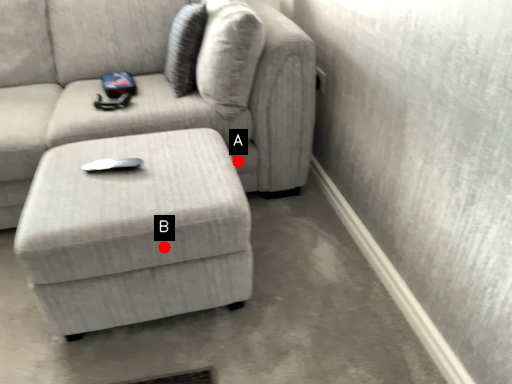
Question: Two points are circled on the image, labeled by A and B beside each circle. Among these points, which one is farthest from the camera?

Choices:
 (A) A is further
 (B) B is further

Answer: (A)